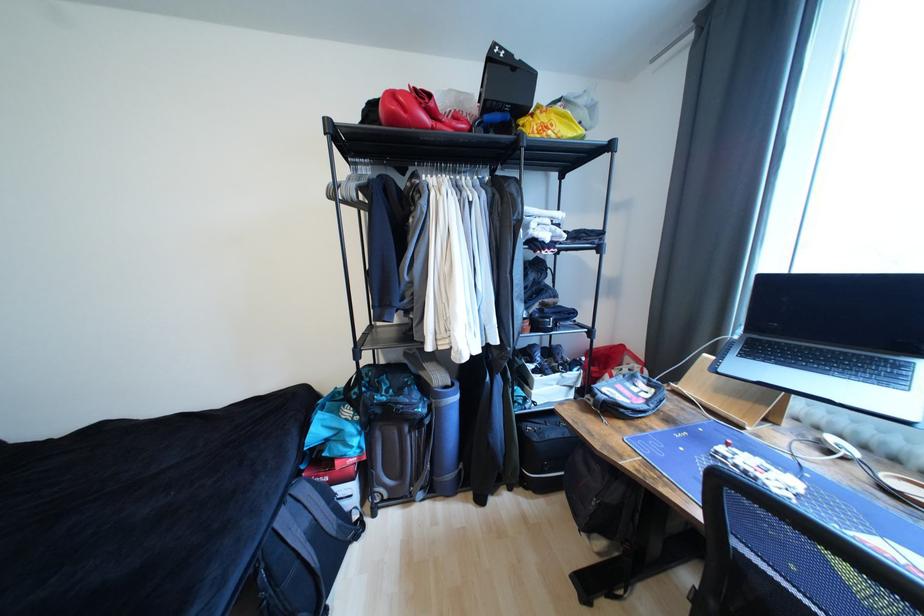
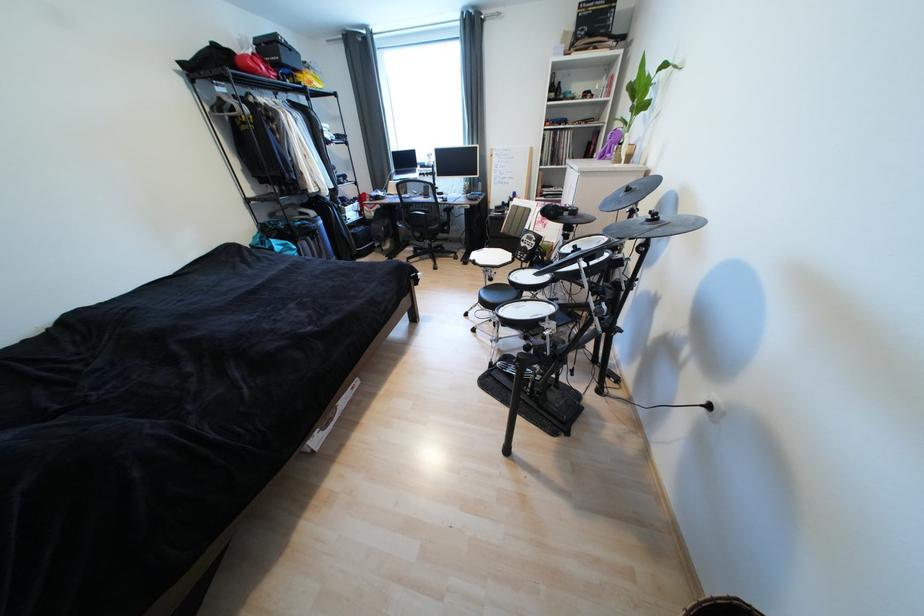
Find the pixel in the second image that matches point 506,110 in the first image.

(294, 68)